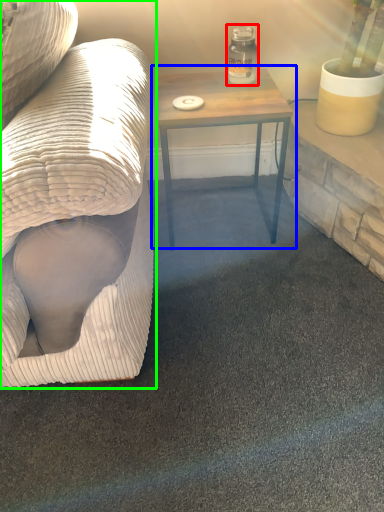
Question: Which object is the closest to the glass jar (highlighted by a red box)? Choose among these: table (highlighted by a blue box) or studio couch (highlighted by a green box).

Choices:
 (A) table
 (B) studio couch

Answer: (A)